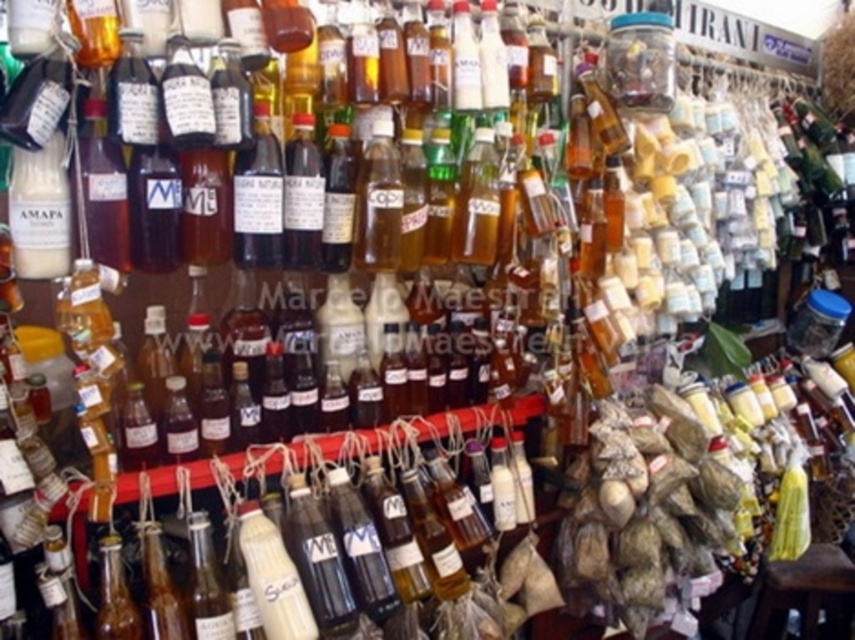
Question: Does brown paper bag at center appear on the right side of brown wooden stool at lower right?

Choices:
 (A) no
 (B) yes

Answer: (A)

Question: Among these points, which one is nearest to the camera?

Choices:
 (A) (644, 465)
 (B) (802, 598)

Answer: (A)

Question: Can you confirm if brown paper bag at center is thinner than brown wooden stool at lower right?

Choices:
 (A) no
 (B) yes

Answer: (A)

Question: Which point appears farthest from the camera in this image?

Choices:
 (A) (836, 552)
 (B) (634, 472)

Answer: (A)

Question: Among these objects, which one is farthest from the camera?

Choices:
 (A) brown paper bag at center
 (B) brown wooden stool at lower right

Answer: (B)

Question: Does brown paper bag at center come behind brown wooden stool at lower right?

Choices:
 (A) yes
 (B) no

Answer: (B)